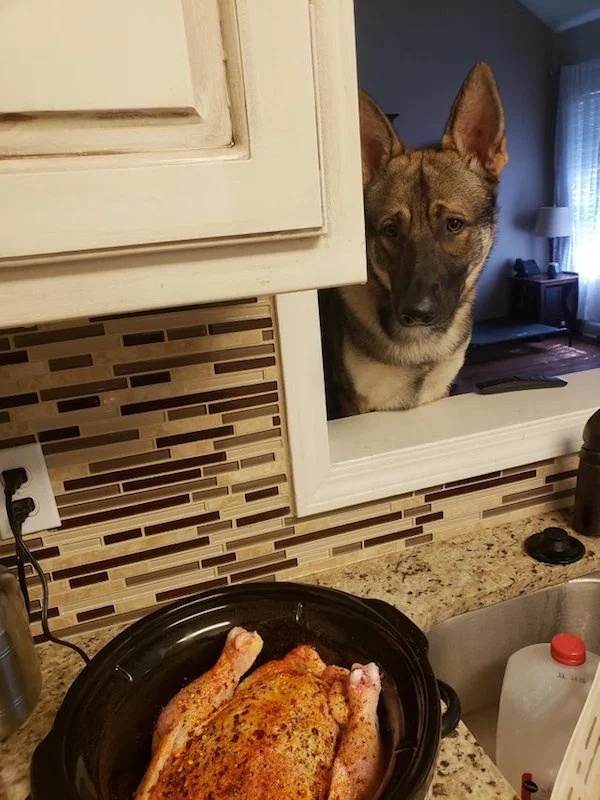
This screenshot has width=600, height=800. What are the coordinates of `crockpot cord` in the screenshot? It's located at (54, 640).